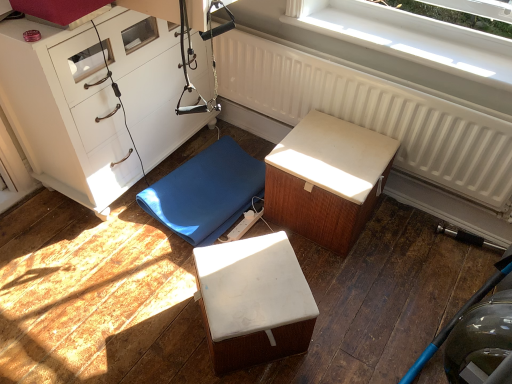
Where is `vacant area that is situated to the right of white matte cube at center, the 2th furniture in the right-to-left sequence`? The height and width of the screenshot is (384, 512). vacant area that is situated to the right of white matte cube at center, the 2th furniture in the right-to-left sequence is located at coordinates (342, 325).